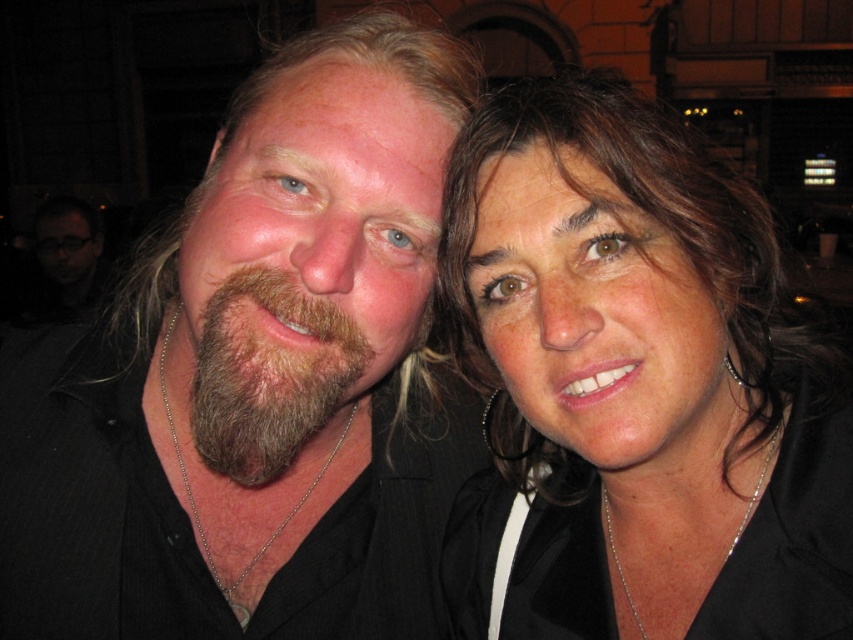
What are the coordinates of the matte black hair at upper right?

The matte black hair at upper right is located at point (637, 385).

You are a photographer setting up a shot for two people. The scene requires that the matte black hair at upper right must not be obscured by the brown fuzzy beard at left. Based on their positions, is this requirement achievable?

The matte black hair at upper right is above the brown fuzzy beard at left, so the requirement is achievable as the beard does not block the hair.

You are a photographer trying to adjust the lighting for a portrait. You notice the matte black hair at upper right and the brown fuzzy beard at left. Which object is positioned to the right side of the other?

The matte black hair at upper right is to the right of the brown fuzzy beard at left.